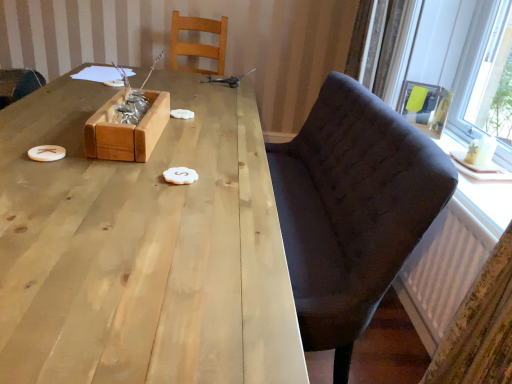
Where is `free region on the left part of wooden box at center`? This screenshot has width=512, height=384. free region on the left part of wooden box at center is located at coordinates (46, 124).